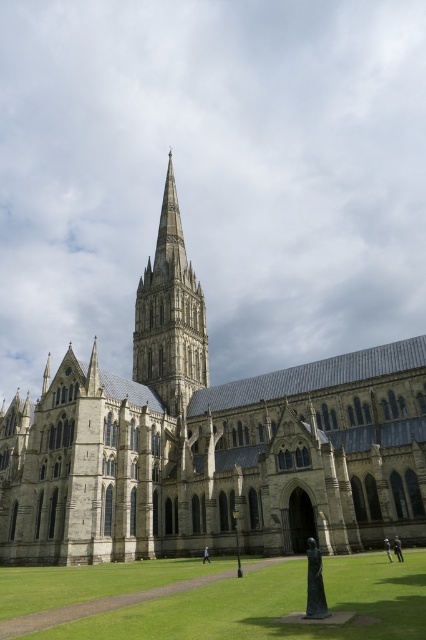
Is gray stone church at center to the left of stone spire at center from the viewer's perspective?

Correct, you'll find gray stone church at center to the left of stone spire at center.

Which is more to the left, gray stone church at center or stone spire at center?

gray stone church at center

Where is `gray stone church at center`? The width and height of the screenshot is (426, 640). gray stone church at center is located at coordinates (210, 442).

Who is lower down, green grass at lower center or stone spire at center?

green grass at lower center is below.

Can you confirm if green grass at lower center is smaller than stone spire at center?

Actually, green grass at lower center might be larger than stone spire at center.

The width and height of the screenshot is (426, 640). Identify the location of green grass at lower center. (224, 598).

Measure the distance between point [411,461] and camera.

Point [411,461] is 52.92 meters from camera.

In the scene shown: Is gray stone church at center shorter than green grass at lower center?

No.

Which is in front, point (146, 428) or point (339, 564)?

Point (339, 564)

Find the location of `gray stone church at center`. gray stone church at center is located at coordinates (210, 442).